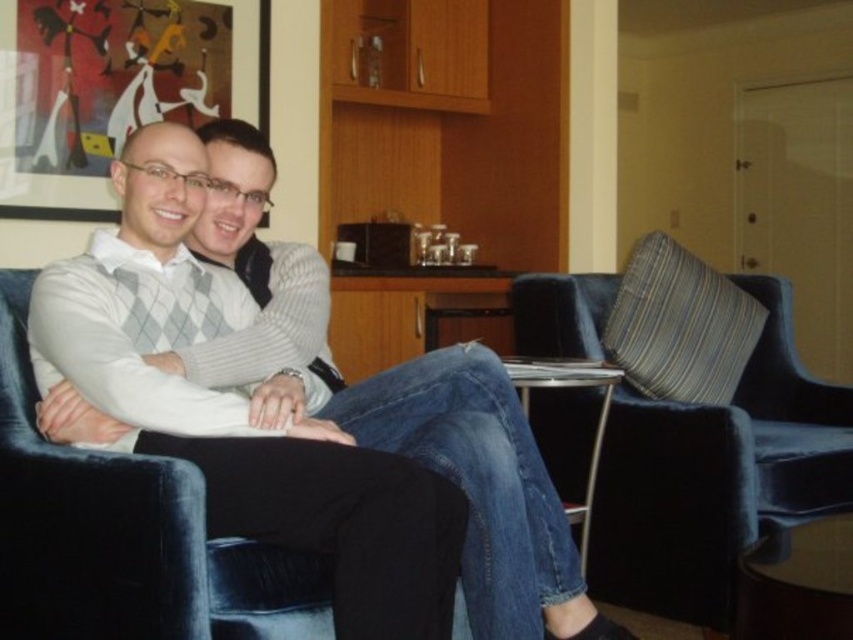
Looking at this image, is white sweater at center taller than velvet blue armchair at right?

Indeed, white sweater at center has a greater height compared to velvet blue armchair at right.

Which is above, white sweater at center or velvet blue armchair at right?

white sweater at center

Where is `white sweater at center`? This screenshot has height=640, width=853. white sweater at center is located at coordinates (285, 422).

Locate an element on the screen. white sweater at center is located at coordinates (285, 422).